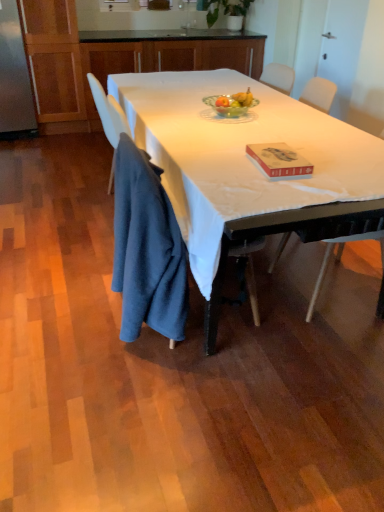
Where is `vacant area that is in front of dark blue fabric at lower left`? vacant area that is in front of dark blue fabric at lower left is located at coordinates (120, 390).